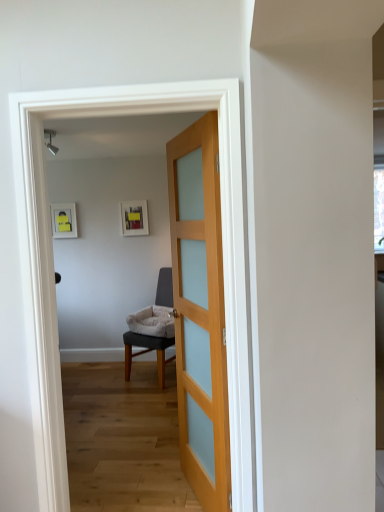
Question: Is point (173, 337) closer or farther from the camera than point (187, 307)?

Choices:
 (A) closer
 (B) farther

Answer: (B)

Question: Considering the relative positions of light gray fabric chair at center and light wood/transparent glass door at center in the image provided, is light gray fabric chair at center to the left or to the right of light wood/transparent glass door at center?

Choices:
 (A) left
 (B) right

Answer: (A)

Question: In the image, is light gray fabric chair at center positioned in front of or behind light wood/transparent glass door at center?

Choices:
 (A) front
 (B) behind

Answer: (B)

Question: From a real-world perspective, is light wood/transparent glass door at center positioned above or below light gray fabric chair at center?

Choices:
 (A) above
 (B) below

Answer: (A)

Question: From their relative heights in the image, would you say light wood/transparent glass door at center is taller or shorter than light gray fabric chair at center?

Choices:
 (A) tall
 (B) short

Answer: (A)

Question: In terms of width, does light wood/transparent glass door at center look wider or thinner when compared to light gray fabric chair at center?

Choices:
 (A) thin
 (B) wide

Answer: (A)

Question: Based on their sizes in the image, would you say light wood/transparent glass door at center is bigger or smaller than light gray fabric chair at center?

Choices:
 (A) big
 (B) small

Answer: (B)